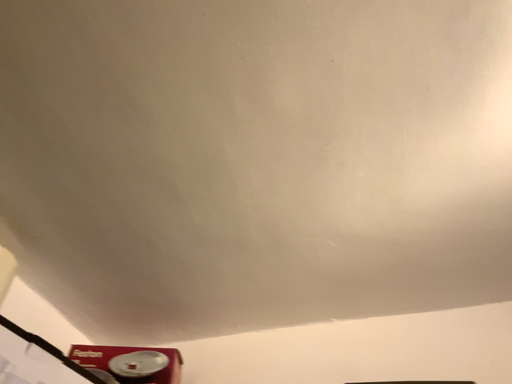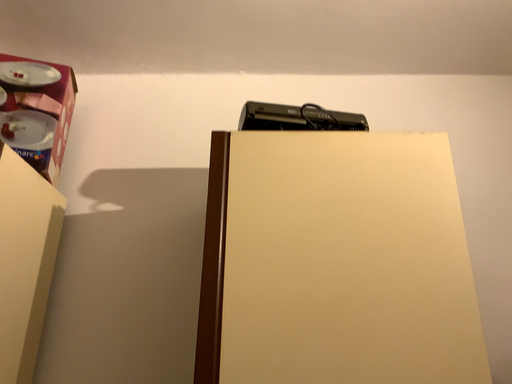
Question: Which way did the camera rotate in the video?

Choices:
 (A) rotated right
 (B) rotated left

Answer: (A)